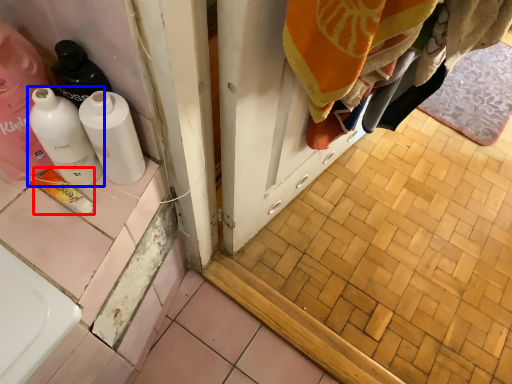
Question: Which of the following is the farthest to the observer, product (highlighted by a red box) or bottle (highlighted by a blue box)?

Choices:
 (A) product
 (B) bottle

Answer: (A)